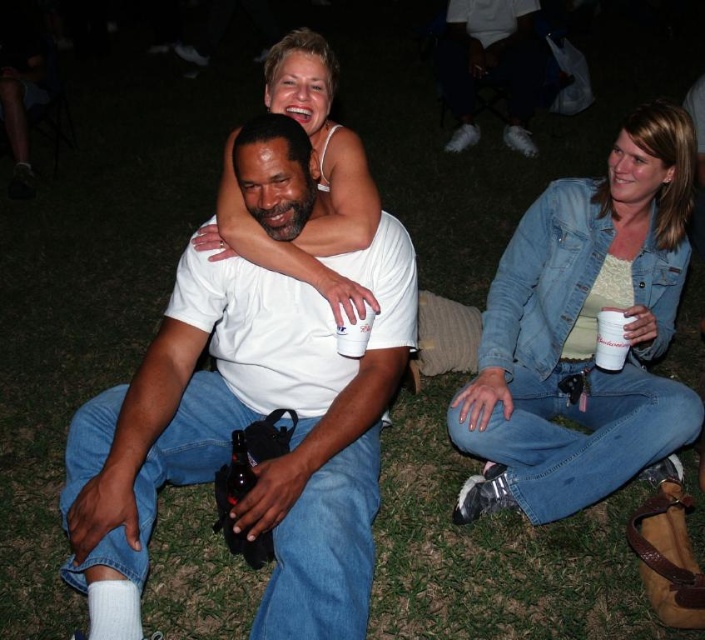
Is white matte t-shirt at center thinner than denim jacket at lower right?

No, white matte t-shirt at center is not thinner than denim jacket at lower right.

Is point (412, 333) closer to viewer compared to point (505, 259)?

Yes, it is.

Between point (137, 426) and point (484, 403), which one is positioned in front?

Point (137, 426) is more forward.

This screenshot has height=640, width=705. I want to click on white matte t-shirt at center, so click(240, 428).

Which is in front, point (606, 300) or point (608, 349)?

Point (608, 349) is more forward.

Between denim jacket at lower right and white plastic cup at lower right, which one has less height?

white plastic cup at lower right

In order to click on denim jacket at lower right in this screenshot , I will do `click(582, 332)`.

At what (x,y) coordinates should I click in order to perform the action: click on denim jacket at lower right. Please return your answer as a coordinate pair (x, y). Looking at the image, I should click on tap(582, 332).

Who is taller, denim jacket at lower right or white paper cup at center?

With more height is denim jacket at lower right.

Locate an element on the screen. This screenshot has height=640, width=705. denim jacket at lower right is located at coordinates (582, 332).